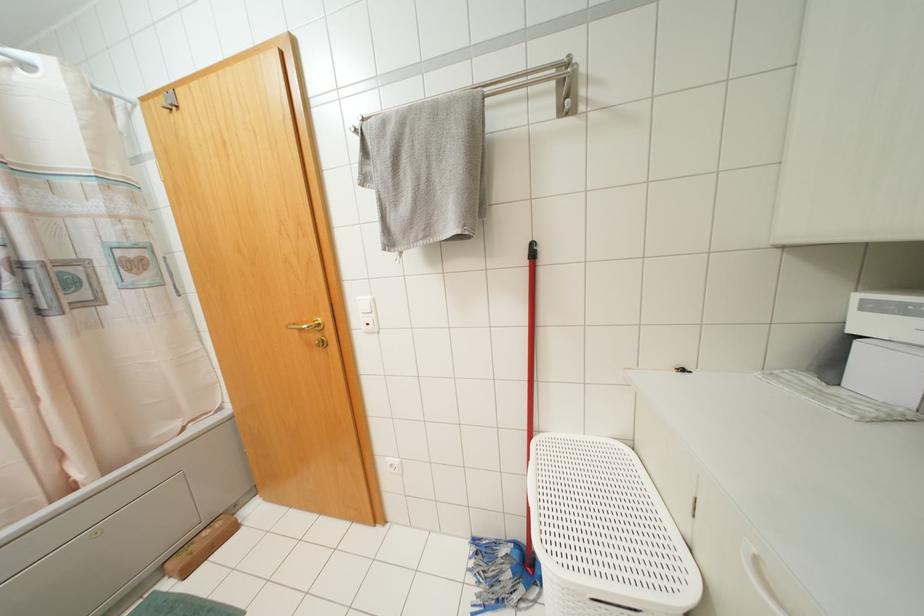
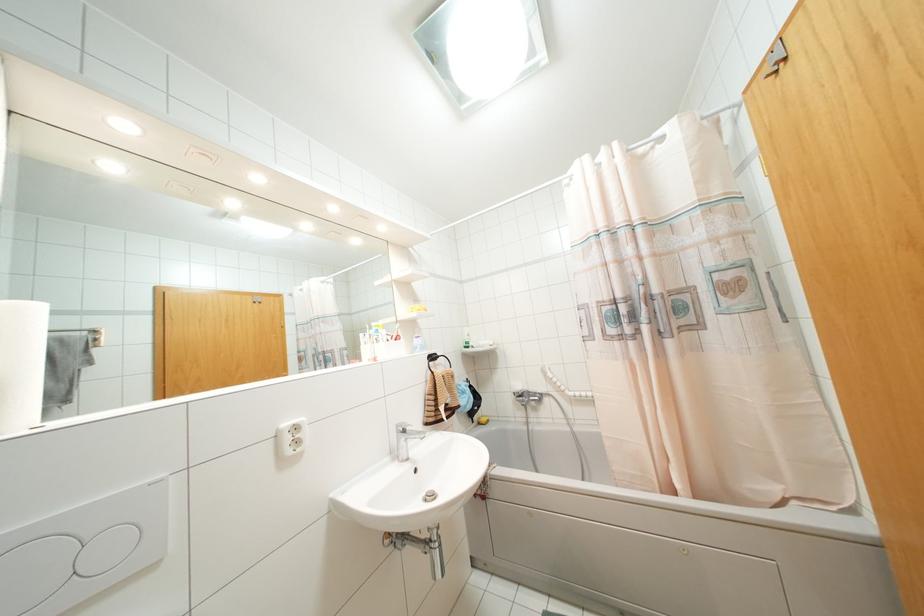
Question: How did the camera likely rotate?

Choices:
 (A) Left
 (B) Right
 (C) Up
 (D) Down

Answer: (A)